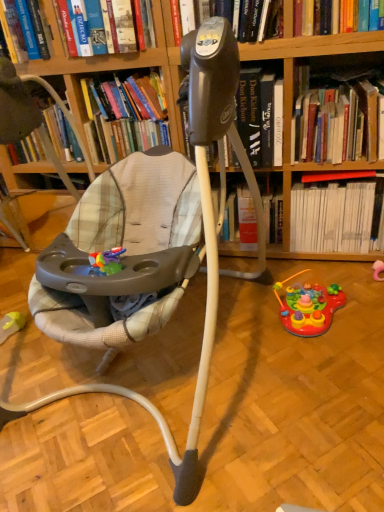
Locate an element on the screen. This screenshot has height=512, width=384. vacant space to the right of rubberized plastic activity center at lower right, the 2th toy positioned from the left is located at coordinates (364, 302).